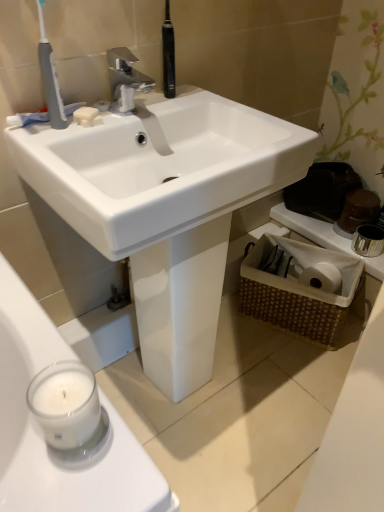
Where is `free spot in front of gray plastic toothbrush at upper left`? The width and height of the screenshot is (384, 512). free spot in front of gray plastic toothbrush at upper left is located at coordinates (53, 147).